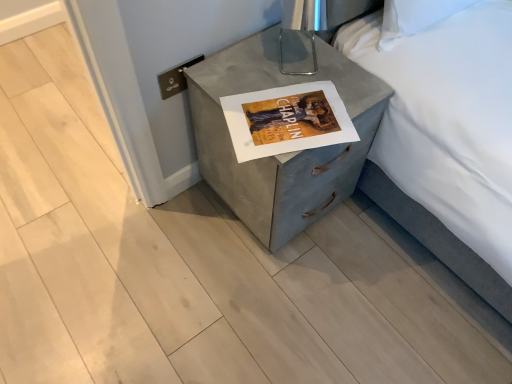
Describe the element at coordinates (282, 154) in the screenshot. I see `concrete side table at center` at that location.

Measure the distance between concrete side table at center and camera.

A distance of 37.85 inches exists between concrete side table at center and camera.

I want to click on concrete side table at center, so click(282, 154).

In order to click on concrete side table at center in this screenshot , I will do `click(282, 154)`.